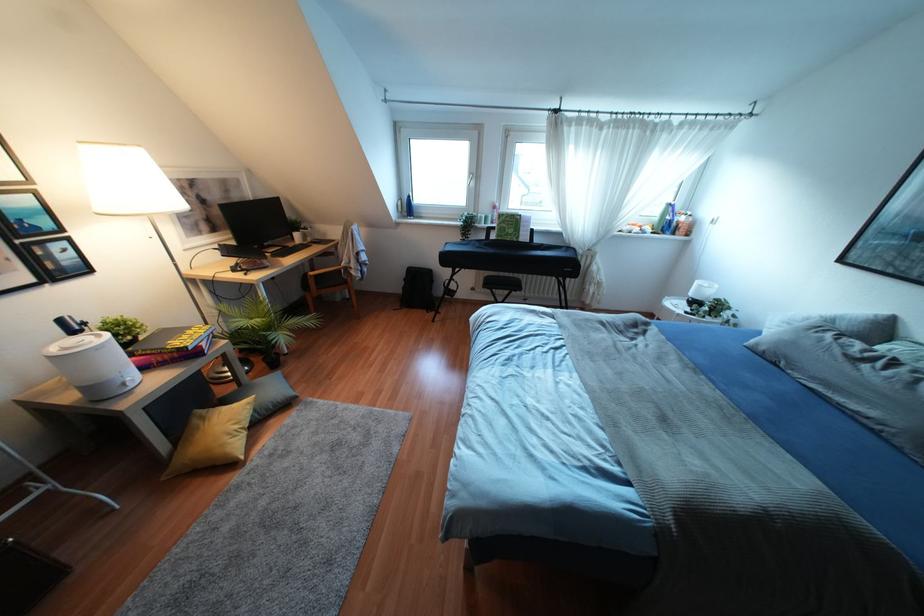
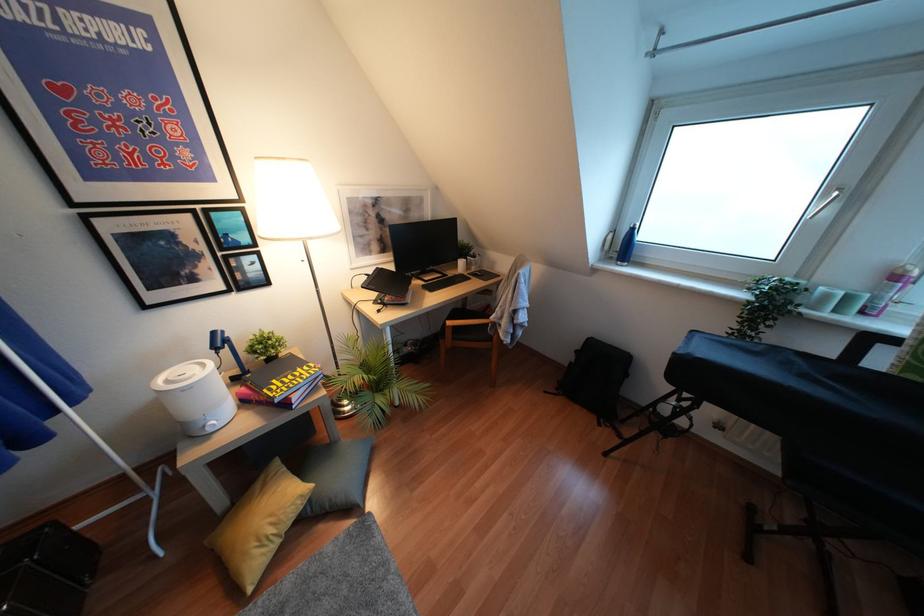
Where in the second image is the point corresponding to point 236,426 from the first image?

(271, 530)